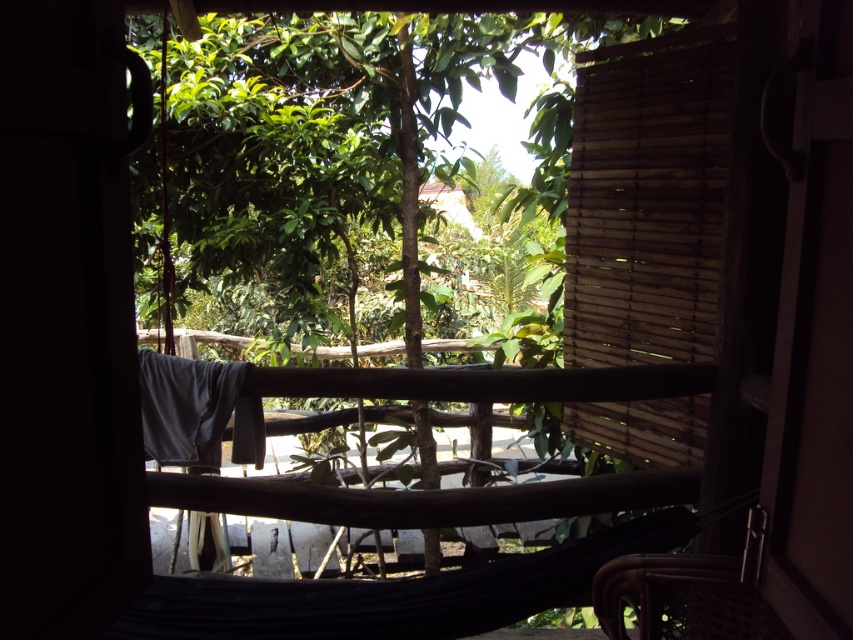
You are sitting in the brown woven chair at lower right and want to look at the green leafy tree at center. In which direction should you look to see the tree?

The green leafy tree at center is located above the brown woven chair at lower right, so you should look upward to see the tree.

Based on the photo, you are standing in a room with a window. You see a point at coordinate (647, 198). What is the object at that point?

The point at coordinate (647, 198) is on wooden blinds at right.

You are an interior designer planning to add a new window treatment to the wooden blinds at right. Considering the view outside, which object in the scene would you need to consider the width of when designing the new treatment to ensure it doesn not block the view of the green leafy tree at center?

You should consider the width of the wooden blinds at right because the green leafy tree at center is wider than the wooden blinds at right, so designing the new treatment around the blinds width ensures the tree remains visible.